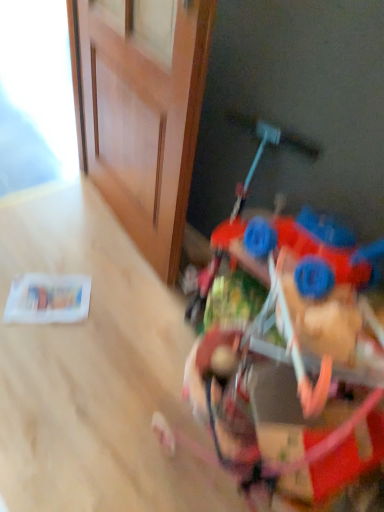
Question: Do you think plastic toy car at lower right is within wooden door at upper left, or outside of it?

Choices:
 (A) inside
 (B) outside

Answer: (B)

Question: Considering their positions, is plastic toy car at lower right located in front of or behind wooden door at upper left?

Choices:
 (A) behind
 (B) front

Answer: (B)

Question: Considering the positions of plastic toy car at lower right and wooden door at upper left in the image, is plastic toy car at lower right bigger or smaller than wooden door at upper left?

Choices:
 (A) big
 (B) small

Answer: (A)

Question: Is point (175, 19) positioned closer to the camera than point (192, 386)?

Choices:
 (A) farther
 (B) closer

Answer: (A)

Question: Choose the correct answer: Is wooden door at upper left inside plastic toy car at lower right or outside it?

Choices:
 (A) inside
 (B) outside

Answer: (B)

Question: In the image, is wooden door at upper left on the left side or the right side of plastic toy car at lower right?

Choices:
 (A) right
 (B) left

Answer: (B)

Question: In the image, is wooden door at upper left positioned in front of or behind plastic toy car at lower right?

Choices:
 (A) front
 (B) behind

Answer: (B)